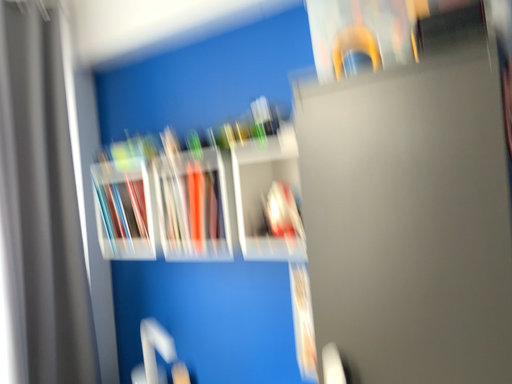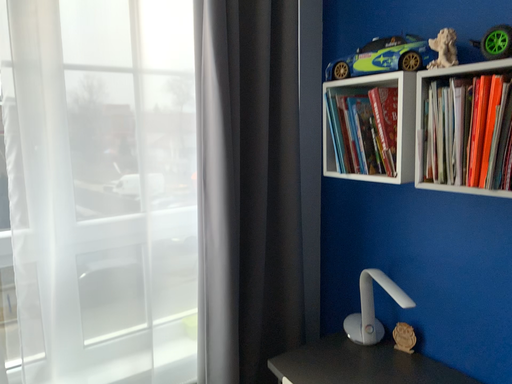
Question: Which way did the camera rotate in the video?

Choices:
 (A) rotated right
 (B) rotated left

Answer: (B)